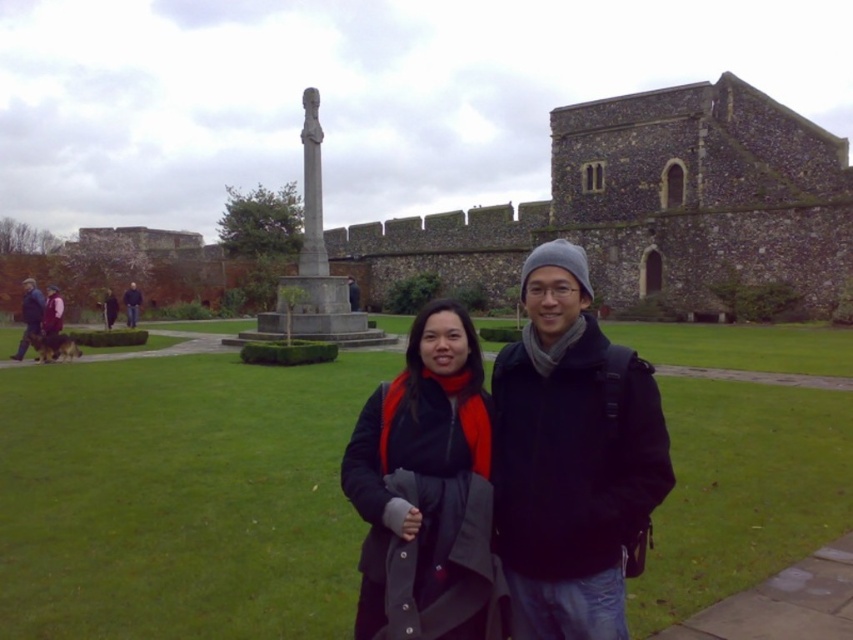
You are standing at the point marked by the coordinates point (570, 456) in the image. Looking around, you see the matte black jacket at center. What object is located at your current position?

The point (570, 456) indicates the location of the matte black jacket at center.

You are a photographer trying to capture a photo of the red fleece jacket at center and the dark blue jacket at left. Based on their positions, which jacket should you focus on first if you want to maintain both in the frame without moving the camera?

The red fleece jacket at center is located below the dark blue jacket at left, so you should focus on the dark blue jacket at left first to ensure both are in frame without moving the camera.

You are taking a photo of the scene and want to ensure the dark blue jacket at left is centered in the frame. Given its current position at point coordinates, can you determine if it is already centered?

The dark blue jacket at left is located at point coordinates, so it is not centered in the frame. Adjust your camera to aim towards the center of the image where the monument stands to center it.